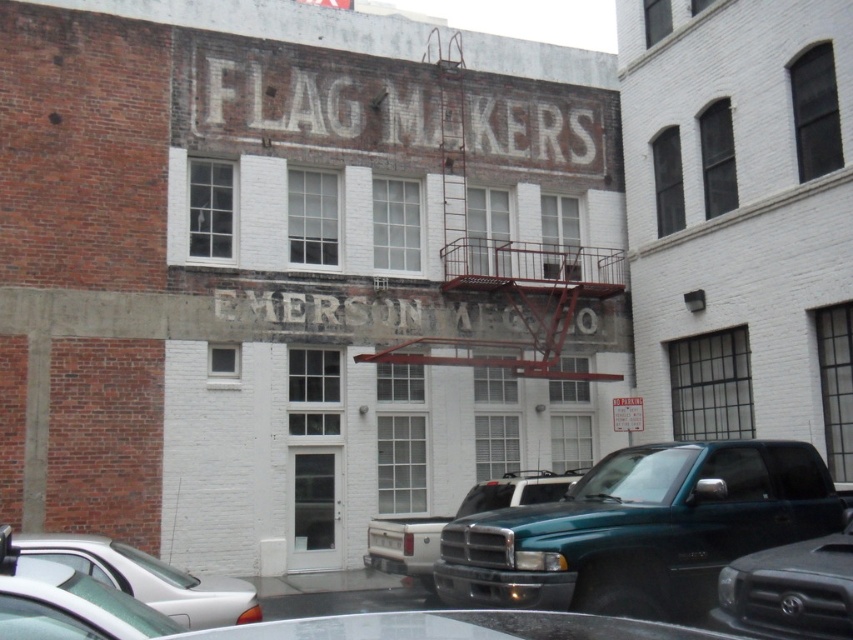
You are a delivery driver who needs to park your truck between the green matte truck at lower right and the teal matte truck at center. The parking space between them is exactly 30 feet long. Can your truck, which is 25 feet long, fit in that space?

The distance between the green matte truck at lower right and the teal matte truck at center is 35.45 feet. Since the parking space is 30 feet long and your truck is only 25 feet long, there is enough space for your truck to fit comfortably within the 30 feet allocated.

You are standing at the corner of the building where the red brick meets the white section. You need to locate the green matte truck at lower right. According to the scene description, where exactly is the green matte truck positioned relative to the building?

The green matte truck at lower right is positioned at point coordinates of (788, 589) relative to the building.